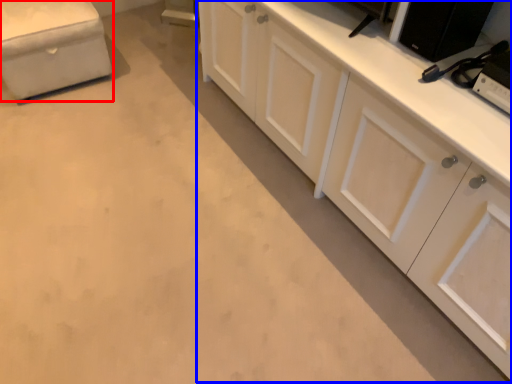
Question: Among these objects, which one is nearest to the camera, furniture (highlighted by a red box) or cabinetry (highlighted by a blue box)?

Choices:
 (A) furniture
 (B) cabinetry

Answer: (B)